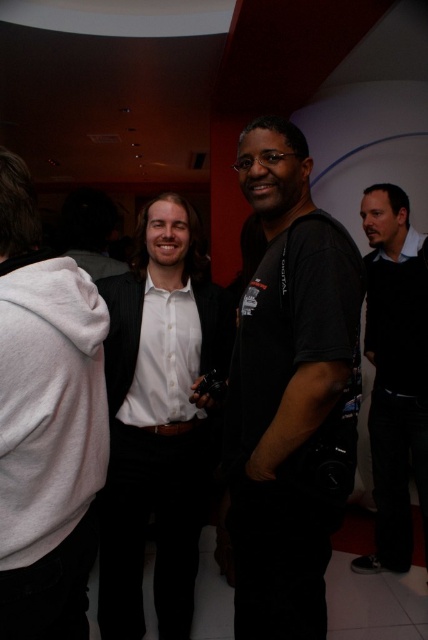
Can you confirm if white glossy shirt at center is positioned to the left of black matte shirt at right?

Correct, you'll find white glossy shirt at center to the left of black matte shirt at right.

Which is above, white glossy shirt at center or black matte shirt at right?

Positioned higher is black matte shirt at right.

Does point (139, 579) come farther from viewer compared to point (386, 476)?

No, (139, 579) is closer to viewer.

I want to click on white glossy shirt at center, so click(x=158, y=419).

How far apart are black cotton t-shirt at center and white glossy shirt at center?

A distance of 18.57 inches exists between black cotton t-shirt at center and white glossy shirt at center.

Who is higher up, black cotton t-shirt at center or white glossy shirt at center?

black cotton t-shirt at center is above.

Which is in front, point (250, 438) or point (136, 609)?

Point (250, 438)

Where is `black cotton t-shirt at center`? black cotton t-shirt at center is located at coordinates (290, 392).

Looking at this image, which is above, black cotton t-shirt at center or white fleece sweatshirt at left?

black cotton t-shirt at center is higher up.

Which is behind, point (258, 618) or point (26, 224)?

The point (258, 618) is more distant.

You are a GUI agent. You are given a task and a screenshot of the screen. Output one action in this format:
    pyautogui.click(x=<x>, y=<y>)
    Task: Click on the black cotton t-shirt at center
    
    Given the screenshot: What is the action you would take?
    pyautogui.click(x=290, y=392)